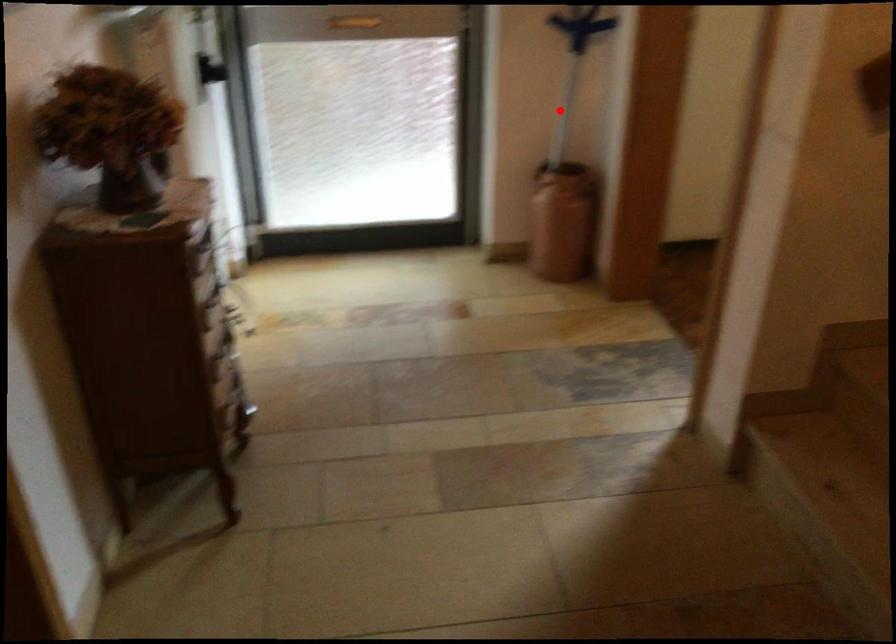
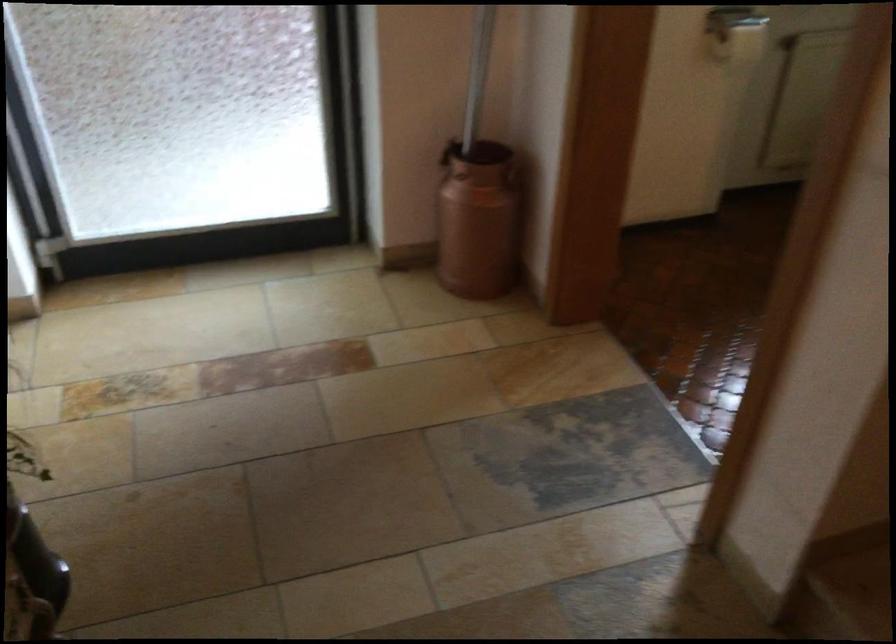
Question: I am providing you with two images of the same scene from different viewpoints. A red point is shown in image1. For the corresponding object point in image2, is it positioned nearer or farther from the camera?

Choices:
 (A) Nearer
 (B) Farther

Answer: (A)